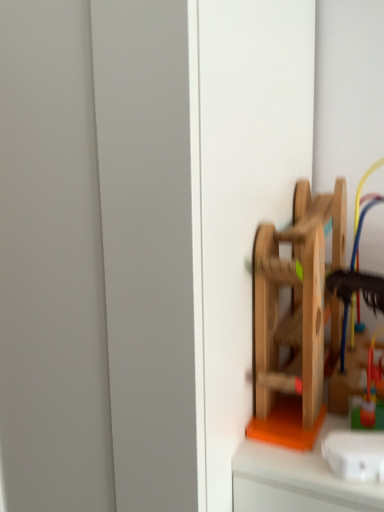
Where is `wooden toy at right, which is counted as the 2th toy, starting from the back`? This screenshot has width=384, height=512. wooden toy at right, which is counted as the 2th toy, starting from the back is located at coordinates [x=296, y=319].

The image size is (384, 512). What do you see at coordinates (296, 319) in the screenshot?
I see `wooden toy at right, which is counted as the 2th toy, starting from the back` at bounding box center [296, 319].

Measure the distance between wooden toy at right, the first toy when ordered from front to back, and camera.

19.11 inches.

The image size is (384, 512). In order to click on rubberized plastic toy at right, acting as the first toy starting from the back in this screenshot , I will do `click(371, 394)`.

What do you see at coordinates (371, 394) in the screenshot?
I see `rubberized plastic toy at right, the second toy viewed from the front` at bounding box center [371, 394].

Measure the distance between rubberized plastic toy at right, acting as the first toy starting from the back, and camera.

rubberized plastic toy at right, acting as the first toy starting from the back, and camera are 20.53 inches apart from each other.

The height and width of the screenshot is (512, 384). Find the location of `wooden toy at right, which is counted as the 2th toy, starting from the back`. wooden toy at right, which is counted as the 2th toy, starting from the back is located at coordinates point(296,319).

Looking at this image, is rubberized plastic toy at right, acting as the first toy starting from the back, to the left of wooden toy at right, which is counted as the 2th toy, starting from the back, from the viewer's perspective?

No, rubberized plastic toy at right, acting as the first toy starting from the back, is not to the left of wooden toy at right, which is counted as the 2th toy, starting from the back.

Is rubberized plastic toy at right, acting as the first toy starting from the back, positioned behind wooden toy at right, which is counted as the 2th toy, starting from the back?

Yes, rubberized plastic toy at right, acting as the first toy starting from the back, is behind wooden toy at right, which is counted as the 2th toy, starting from the back.

Is point (380, 415) behind point (320, 270)?

No, (380, 415) is in front of (320, 270).

From the image's perspective, which one is positioned lower, rubberized plastic toy at right, acting as the first toy starting from the back, or wooden toy at right, which is counted as the 2th toy, starting from the back?

rubberized plastic toy at right, acting as the first toy starting from the back, is shown below in the image.

From a real-world perspective, is rubberized plastic toy at right, the second toy viewed from the front, above or below wooden toy at right, which is counted as the 2th toy, starting from the back?

rubberized plastic toy at right, the second toy viewed from the front, is below wooden toy at right, which is counted as the 2th toy, starting from the back.

Which object is thinner, rubberized plastic toy at right, acting as the first toy starting from the back, or wooden toy at right, which is counted as the 2th toy, starting from the back?

rubberized plastic toy at right, acting as the first toy starting from the back, is thinner.

Is rubberized plastic toy at right, acting as the first toy starting from the back, taller or shorter than wooden toy at right, which is counted as the 2th toy, starting from the back?

rubberized plastic toy at right, acting as the first toy starting from the back, is shorter than wooden toy at right, which is counted as the 2th toy, starting from the back.

Looking at the image, does rubberized plastic toy at right, acting as the first toy starting from the back, seem bigger or smaller compared to wooden toy at right, which is counted as the 2th toy, starting from the back?

rubberized plastic toy at right, acting as the first toy starting from the back, is smaller than wooden toy at right, which is counted as the 2th toy, starting from the back.

Would you say rubberized plastic toy at right, the second toy viewed from the front, contains wooden toy at right, which is counted as the 2th toy, starting from the back?

No, wooden toy at right, which is counted as the 2th toy, starting from the back, is not a part of rubberized plastic toy at right, the second toy viewed from the front.

Can you see rubberized plastic toy at right, acting as the first toy starting from the back, touching wooden toy at right, which is counted as the 2th toy, starting from the back?

No, rubberized plastic toy at right, acting as the first toy starting from the back, is not with wooden toy at right, which is counted as the 2th toy, starting from the back.

Is rubberized plastic toy at right, acting as the first toy starting from the back, facing away from wooden toy at right, which is counted as the 2th toy, starting from the back?

That's not correct — rubberized plastic toy at right, acting as the first toy starting from the back, is not looking away from wooden toy at right, which is counted as the 2th toy, starting from the back.

How different are the orientations of rubberized plastic toy at right, the second toy viewed from the front, and wooden toy at right, which is counted as the 2th toy, starting from the back, in degrees?

The angular difference between rubberized plastic toy at right, the second toy viewed from the front, and wooden toy at right, which is counted as the 2th toy, starting from the back, is 0.000614 degrees.

This screenshot has width=384, height=512. Identify the location of toy below the wooden toy at right, the first toy when ordered from front to back (from the image's perspective). 371,394.

Considering the positions of objects wooden toy at right, which is counted as the 2th toy, starting from the back, and rubberized plastic toy at right, acting as the first toy starting from the back, in the image provided, who is more to the right, wooden toy at right, which is counted as the 2th toy, starting from the back, or rubberized plastic toy at right, acting as the first toy starting from the back,?

rubberized plastic toy at right, acting as the first toy starting from the back, is more to the right.

In the image, is wooden toy at right, the first toy when ordered from front to back, positioned in front of or behind rubberized plastic toy at right, acting as the first toy starting from the back?

Visually, wooden toy at right, the first toy when ordered from front to back, is located in front of rubberized plastic toy at right, acting as the first toy starting from the back.

Is point (312, 405) farther from camera compared to point (373, 347)?

No, it is in front of (373, 347).

From the image's perspective, is wooden toy at right, which is counted as the 2th toy, starting from the back, above or below rubberized plastic toy at right, acting as the first toy starting from the back?

Clearly, from the image's perspective, wooden toy at right, which is counted as the 2th toy, starting from the back, is above rubberized plastic toy at right, acting as the first toy starting from the back.

From a real-world perspective, which object stands above the other?

wooden toy at right, the first toy when ordered from front to back, from a real-world perspective.

Which object is thinner, wooden toy at right, which is counted as the 2th toy, starting from the back, or rubberized plastic toy at right, acting as the first toy starting from the back?

rubberized plastic toy at right, acting as the first toy starting from the back, is thinner.

Can you confirm if wooden toy at right, the first toy when ordered from front to back, is taller than rubberized plastic toy at right, acting as the first toy starting from the back?

→ Correct, wooden toy at right, the first toy when ordered from front to back, is much taller as rubberized plastic toy at right, acting as the first toy starting from the back.

Who is smaller, wooden toy at right, the first toy when ordered from front to back, or rubberized plastic toy at right, the second toy viewed from the front?

rubberized plastic toy at right, the second toy viewed from the front, is smaller.

Choose the correct answer: Is wooden toy at right, the first toy when ordered from front to back, inside rubberized plastic toy at right, acting as the first toy starting from the back, or outside it?

wooden toy at right, the first toy when ordered from front to back, lies outside rubberized plastic toy at right, acting as the first toy starting from the back.

Is wooden toy at right, the first toy when ordered from front to back, next to rubberized plastic toy at right, the second toy viewed from the front, and touching it?

No, wooden toy at right, the first toy when ordered from front to back, is not touching rubberized plastic toy at right, the second toy viewed from the front.

Consider the image. Is wooden toy at right, the first toy when ordered from front to back, turned away from rubberized plastic toy at right, acting as the first toy starting from the back?

That's not correct — wooden toy at right, the first toy when ordered from front to back, is not looking away from rubberized plastic toy at right, acting as the first toy starting from the back.

How many degrees apart are the facing directions of wooden toy at right, which is counted as the 2th toy, starting from the back, and rubberized plastic toy at right, acting as the first toy starting from the back?

They differ by 0.000614 degrees in their facing directions.

At what (x,y) coordinates should I click in order to perform the action: click on toy that appears on the left of rubberized plastic toy at right, the second toy viewed from the front. Please return your answer as a coordinate pair (x, y). The height and width of the screenshot is (512, 384). Looking at the image, I should click on (296, 319).

Locate an element on the screen. The image size is (384, 512). toy behind the wooden toy at right, which is counted as the 2th toy, starting from the back is located at coordinates (371, 394).

Where is `toy above the rubberized plastic toy at right, the second toy viewed from the front (from the image's perspective)`? This screenshot has height=512, width=384. toy above the rubberized plastic toy at right, the second toy viewed from the front (from the image's perspective) is located at coordinates (296, 319).